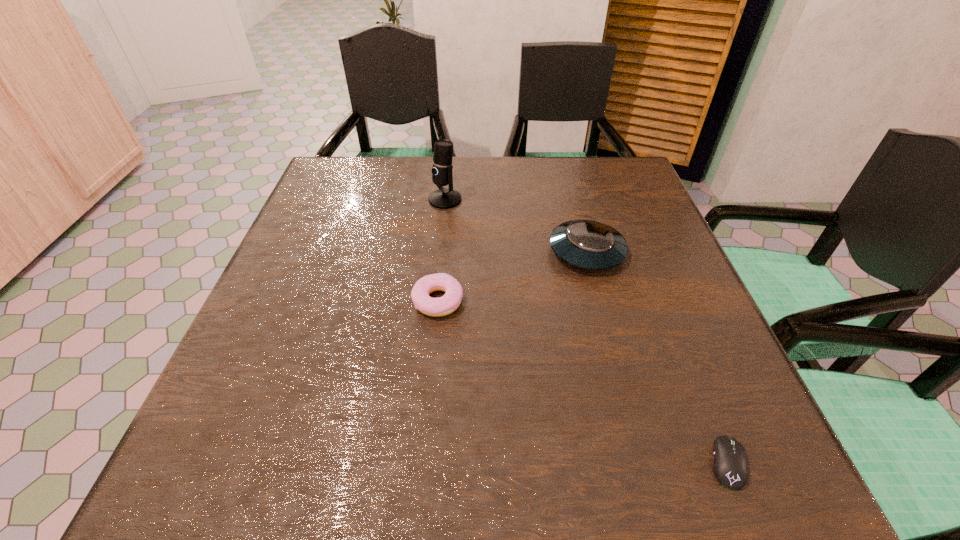
Find the location of a particular element. the tallest object is located at coordinates (442, 198).

This screenshot has height=540, width=960. Find the location of `microphone`. microphone is located at coordinates (442, 198).

The height and width of the screenshot is (540, 960). Find the location of `the second object from right to left`. the second object from right to left is located at coordinates pyautogui.click(x=586, y=244).

The height and width of the screenshot is (540, 960). Identify the location of the second farthest object. (586, 244).

I want to click on the third tallest object, so click(448, 303).

This screenshot has height=540, width=960. I want to click on the third farthest object, so click(448, 303).

You are a GUI agent. You are given a task and a screenshot of the screen. Output one action in this format:
    pyautogui.click(x=<x>, y=<y>)
    Task: Click on the nearest object
    The width and height of the screenshot is (960, 540).
    Given the screenshot: What is the action you would take?
    pyautogui.click(x=730, y=467)

The image size is (960, 540). I want to click on the shortest object, so click(730, 467).

I want to click on free space located on the right of the farthest object, so click(617, 200).

In order to click on vacant space located on the left of the saucer in this screenshot , I will do `click(455, 252)`.